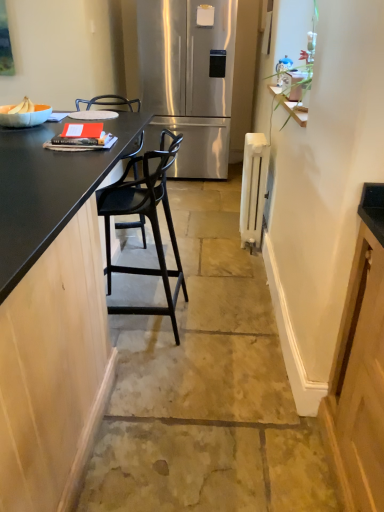
Question: Can you confirm if stainless steel refrigerator at center is wider than white painted metal radiator at right?

Choices:
 (A) no
 (B) yes

Answer: (B)

Question: Does stainless steel refrigerator at center come behind white painted metal radiator at right?

Choices:
 (A) yes
 (B) no

Answer: (A)

Question: Is stainless steel refrigerator at center turned away from white painted metal radiator at right?

Choices:
 (A) no
 (B) yes

Answer: (A)

Question: Is stainless steel refrigerator at center to the left of white painted metal radiator at right from the viewer's perspective?

Choices:
 (A) no
 (B) yes

Answer: (B)

Question: From a real-world perspective, is stainless steel refrigerator at center positioned under white painted metal radiator at right based on gravity?

Choices:
 (A) yes
 (B) no

Answer: (B)

Question: Is stainless steel refrigerator at center far away from white painted metal radiator at right?

Choices:
 (A) no
 (B) yes

Answer: (B)

Question: From a real-world perspective, is white painted metal radiator at right below black matte countertop at left?

Choices:
 (A) yes
 (B) no

Answer: (A)

Question: Is white painted metal radiator at right further to camera compared to black matte countertop at left?

Choices:
 (A) no
 (B) yes

Answer: (B)

Question: From the image's perspective, is white painted metal radiator at right beneath black matte countertop at left?

Choices:
 (A) no
 (B) yes

Answer: (A)

Question: Are white painted metal radiator at right and black matte countertop at left making contact?

Choices:
 (A) no
 (B) yes

Answer: (A)

Question: Is white painted metal radiator at right oriented away from black matte countertop at left?

Choices:
 (A) no
 (B) yes

Answer: (A)

Question: Can you confirm if white painted metal radiator at right is thinner than black matte countertop at left?

Choices:
 (A) yes
 (B) no

Answer: (A)

Question: Is matte black barstool at center to the left of black matte countertop at left from the viewer's perspective?

Choices:
 (A) yes
 (B) no

Answer: (B)